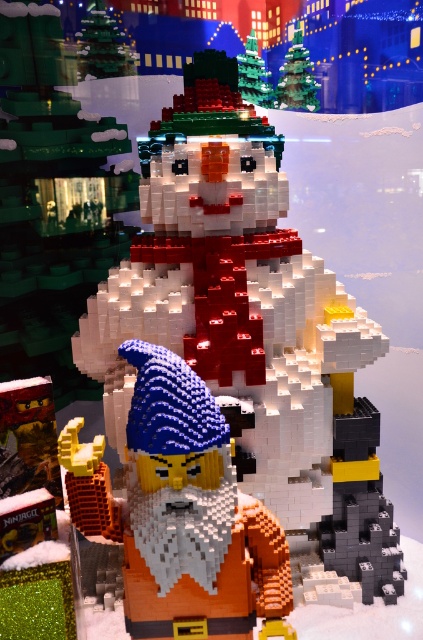
You are standing in front of a LEGO display and want to take a photo of the white matte snowman at center. If the recommended focusing distance for your camera is 10 feet, will you need to adjust the focus to capture the snowman clearly?

The white matte snowman at center is 10.88 feet away from the viewer. Since the recommended focusing distance is 10 feet, you will need to adjust the focus slightly to accommodate the extra distance for a clear photo.

Consider the image. You are a LEGO enthusiast examining the festive display. You notice two snowmen labeled as white matte snowman at center and matte white snowman at center. Which one is placed higher up in the image?

The white matte snowman at center is positioned under the matte white snowman at center, so the matte white snowman at center is placed higher up in the image.